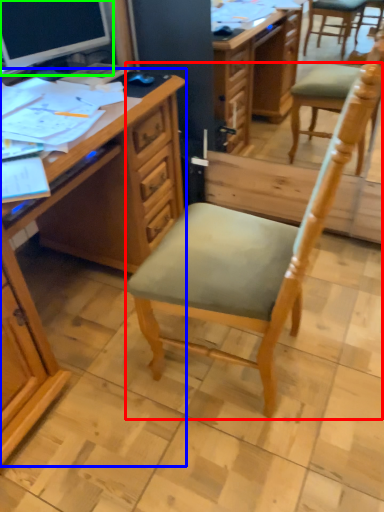
Question: Which object is the farthest from chair (highlighted by a red box)? Choose among these: desk (highlighted by a blue box) or computer monitor (highlighted by a green box).

Choices:
 (A) desk
 (B) computer monitor

Answer: (B)